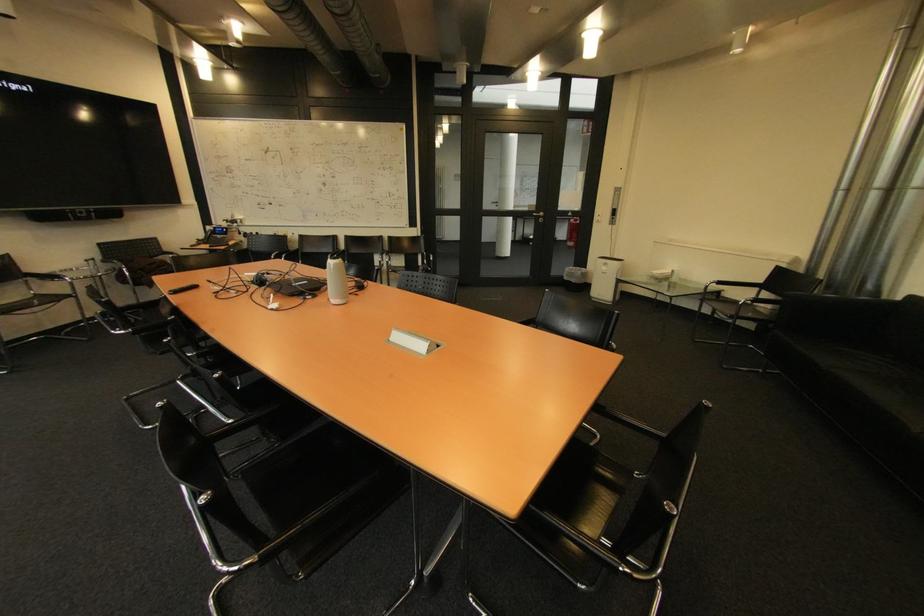
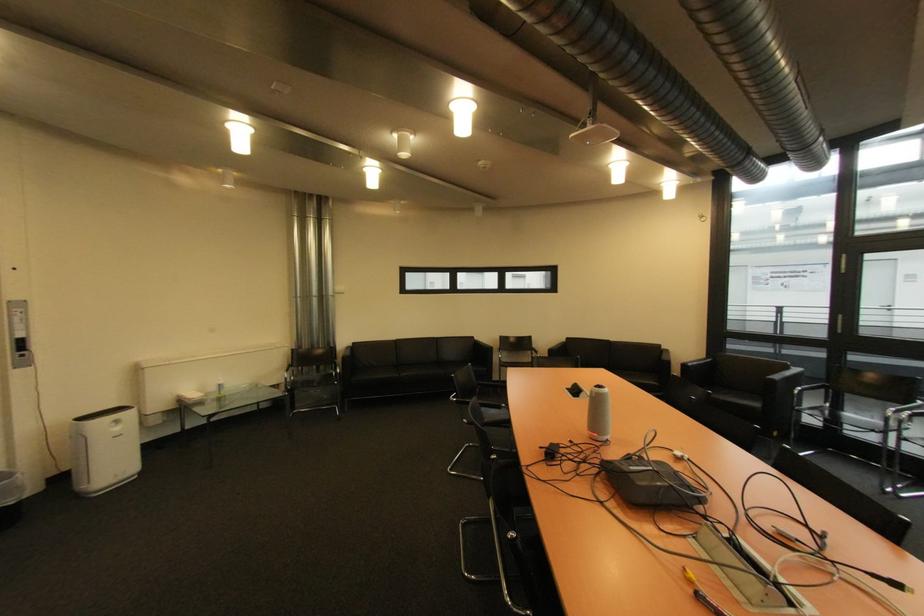
Locate, in the second image, the point that corresponds to (x=785, y=270) in the first image.

(301, 352)